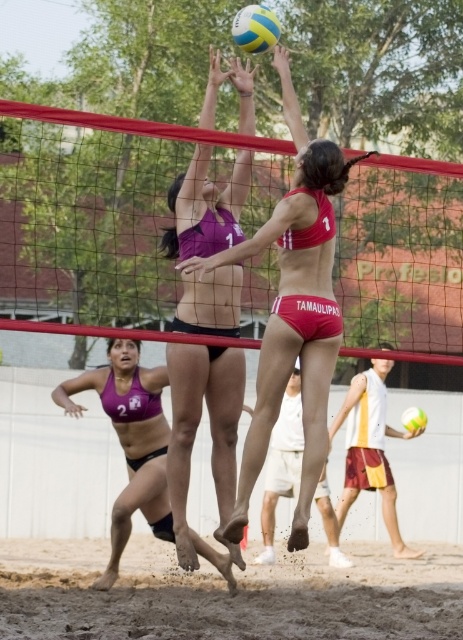
Who is lower down, red mesh net at center or matte purple bikini at center?

matte purple bikini at center is below.

Who is higher up, red mesh net at center or matte purple bikini at center?

red mesh net at center

Where is `red mesh net at center`? This screenshot has height=640, width=463. red mesh net at center is located at coordinates (105, 211).

Identify the location of red mesh net at center. The image size is (463, 640). (105, 211).

Is matte pink bikini at center positioned before yellow and blue striped volleyball at center?

Yes, matte pink bikini at center is closer to the viewer.

The image size is (463, 640). Describe the element at coordinates (294, 308) in the screenshot. I see `matte pink bikini at center` at that location.

You are a GUI agent. You are given a task and a screenshot of the screen. Output one action in this format:
    pyautogui.click(x=<x>, y=<y>)
    Task: Click on the matte pink bikini at center
    Image resolution: width=463 pixels, height=640 pixels.
    Given the screenshot: What is the action you would take?
    pyautogui.click(x=294, y=308)

Does purple matte bikini at lower left appear on the right side of yellow and blue striped volleyball at center?

Incorrect, purple matte bikini at lower left is not on the right side of yellow and blue striped volleyball at center.

Is point (149, 508) in front of point (423, 412)?

Yes, point (149, 508) is in front of point (423, 412).

Is point (106, 401) more distant than point (425, 420)?

No, (106, 401) is closer to viewer.

Where is `purple matte bikini at lower left`? This screenshot has width=463, height=640. purple matte bikini at lower left is located at coordinates (130, 440).